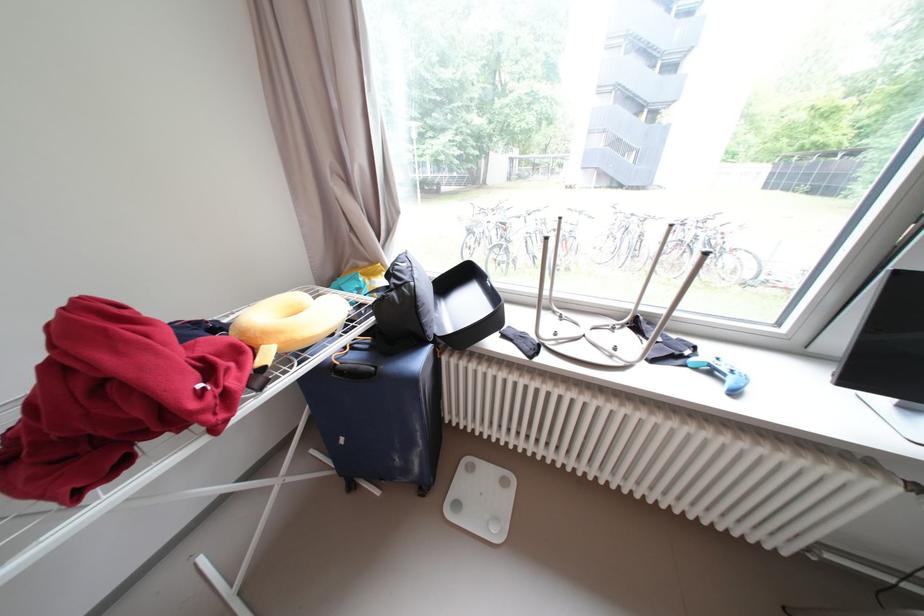
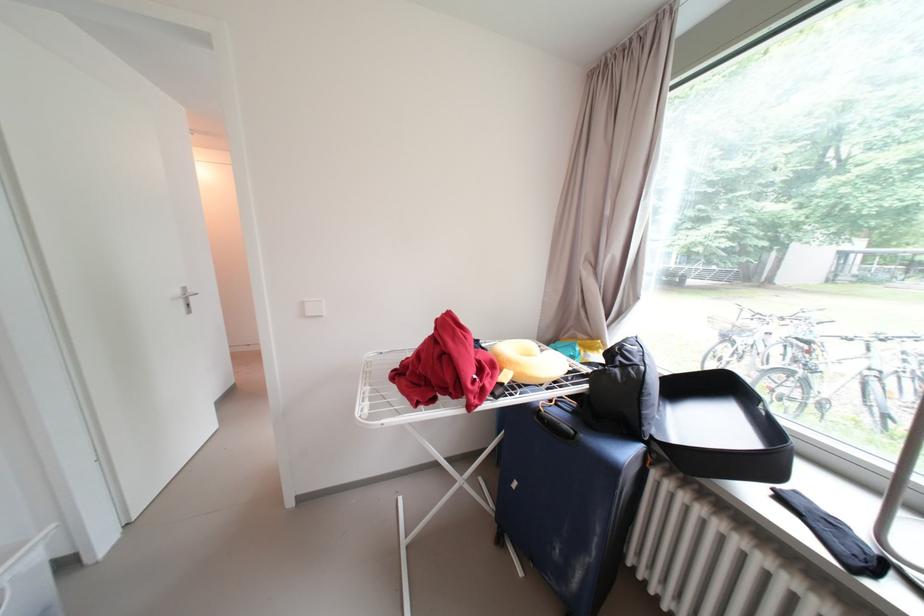
The point at (507, 336) is marked in the first image. Where is the corresponding point in the second image?

(781, 493)